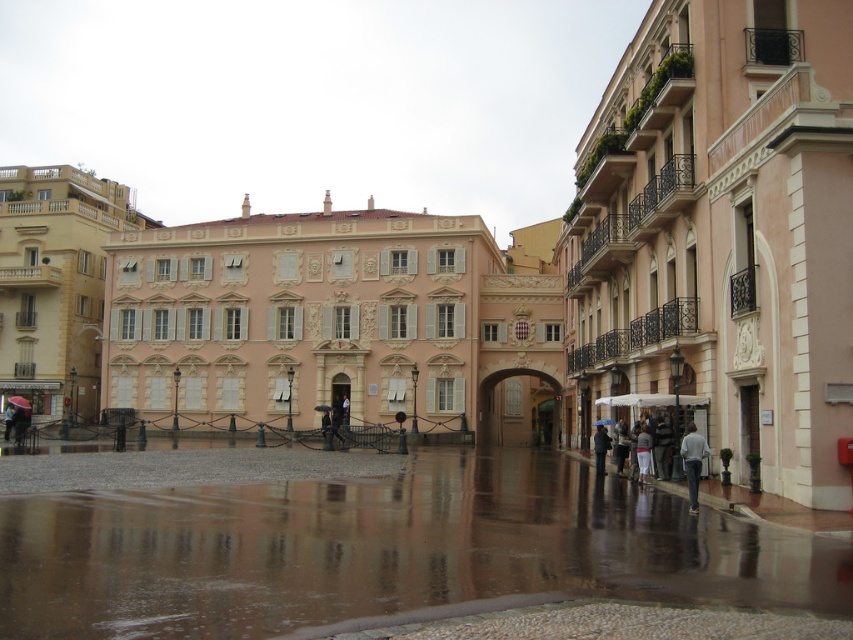
Between gray cotton sweater at lower right and blue fabric umbrella at center, which one is positioned lower?

blue fabric umbrella at center is lower down.

Which is above, gray cotton sweater at lower right or blue fabric umbrella at center?

Positioned higher is gray cotton sweater at lower right.

Which is in front, point (697, 497) or point (601, 422)?

Point (697, 497) is more forward.

The width and height of the screenshot is (853, 640). I want to click on gray cotton sweater at lower right, so click(692, 461).

Who is positioned more to the left, matte pink building at center or matte black umbrella at lower left?

matte black umbrella at lower left is more to the left.

The height and width of the screenshot is (640, 853). What do you see at coordinates (334, 321) in the screenshot?
I see `matte pink building at center` at bounding box center [334, 321].

What do you see at coordinates (334, 321) in the screenshot? I see `matte pink building at center` at bounding box center [334, 321].

Where is `matte pink building at center`? matte pink building at center is located at coordinates (334, 321).

I want to click on glossy concrete pavement at center, so click(384, 550).

Does glossy concrete pavement at center appear over dark gray fabric umbrella at lower right?

Correct, glossy concrete pavement at center is located above dark gray fabric umbrella at lower right.

Who is more forward, (x=262, y=602) or (x=599, y=461)?

Point (x=262, y=602) is more forward.

Locate an element on the screen. This screenshot has width=853, height=640. glossy concrete pavement at center is located at coordinates pos(384,550).